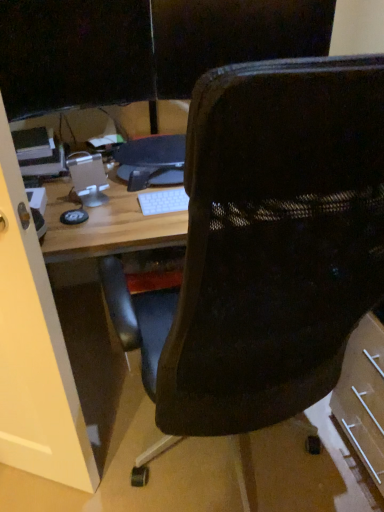
Identify the location of vacant area that lies in front of transparent glass door at left. (37, 498).